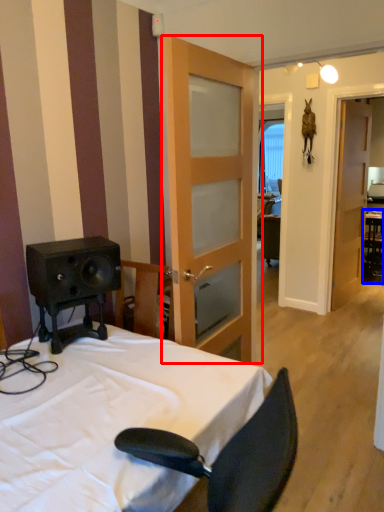
Question: Which object is closer to the camera taking this photo, door (highlighted by a red box) or table (highlighted by a blue box)?

Choices:
 (A) door
 (B) table

Answer: (A)